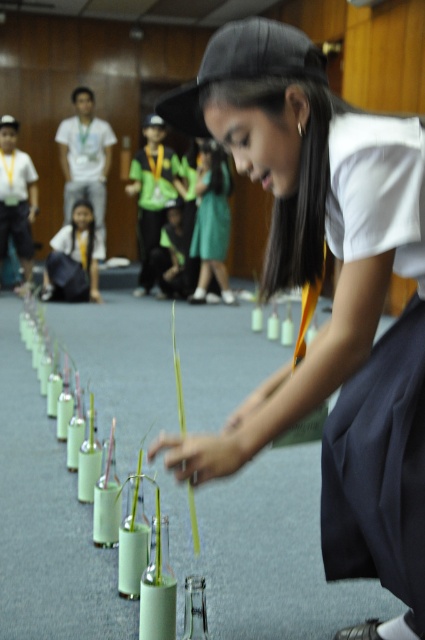
Question: Which point is farther to the camera?

Choices:
 (A) (422, 131)
 (B) (203, 236)
 (C) (85, 248)

Answer: (B)

Question: Is white matte uniform at center to the right of matte black backpack at center from the viewer's perspective?

Choices:
 (A) yes
 (B) no

Answer: (A)

Question: Which object is closer to the camera taking this photo?

Choices:
 (A) green fabric dress at center
 (B) matte black backpack at center
 (C) white matte uniform at center

Answer: (C)

Question: Is white matte uniform at center smaller than green fabric dress at center?

Choices:
 (A) no
 (B) yes

Answer: (A)

Question: In this image, where is white matte uniform at center located relative to green fabric dress at center?

Choices:
 (A) below
 (B) above

Answer: (A)

Question: Estimate the real-world distances between objects in this image. Which object is farther from the matte black backpack at center?

Choices:
 (A) green fabric dress at center
 (B) white matte uniform at center

Answer: (B)